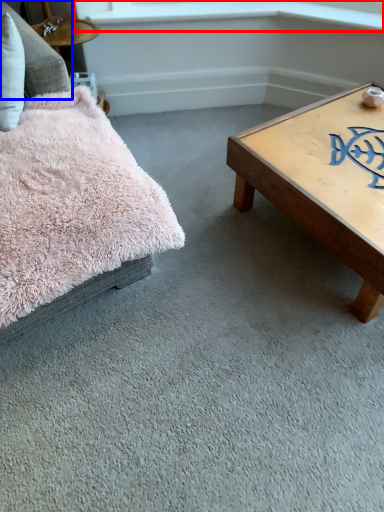
Question: Which point is further to the camera, window sill (highlighted by a red box) or pillow (highlighted by a blue box)?

Choices:
 (A) window sill
 (B) pillow

Answer: (A)